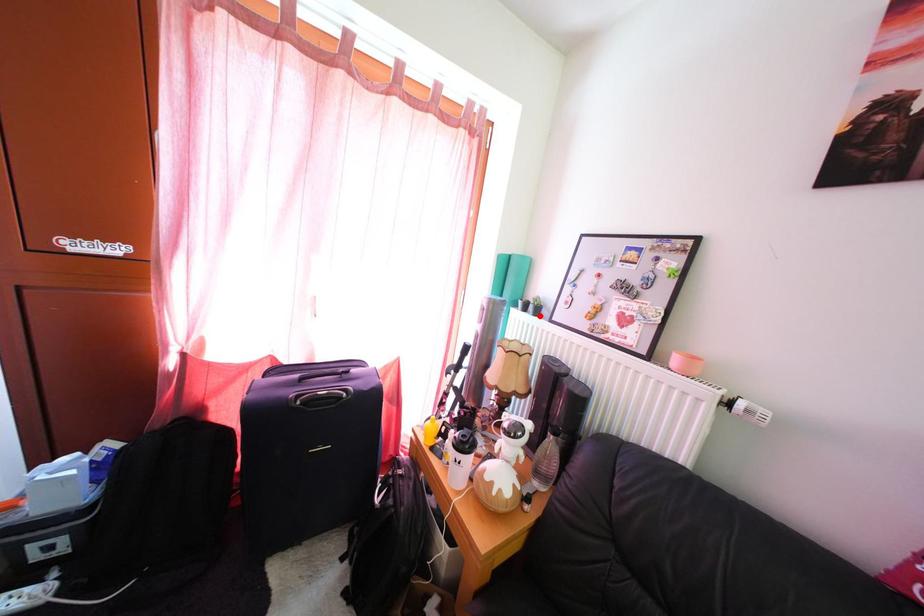
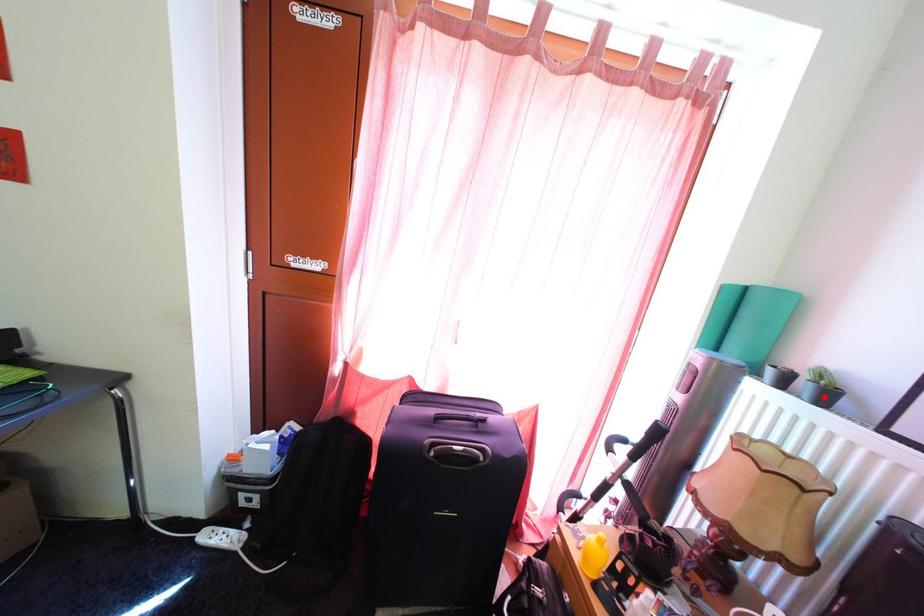
I am providing you with two images of the same scene from different viewpoints. A red point is marked on the first image and another point is marked on the second image. Do the highlighted points in image1 and image2 indicate the same real-world spot?

No